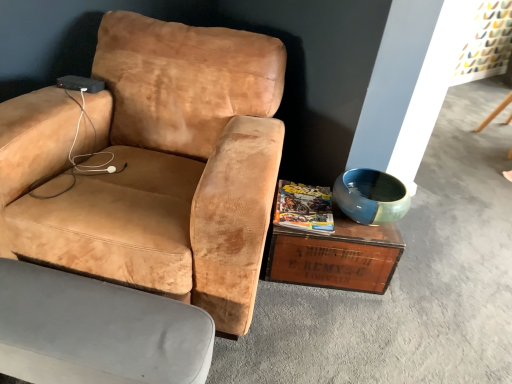
Find the location of a particular element. The height and width of the screenshot is (384, 512). free space between blue glossy bowl at right and matte yellow magazine at center is located at coordinates (358, 244).